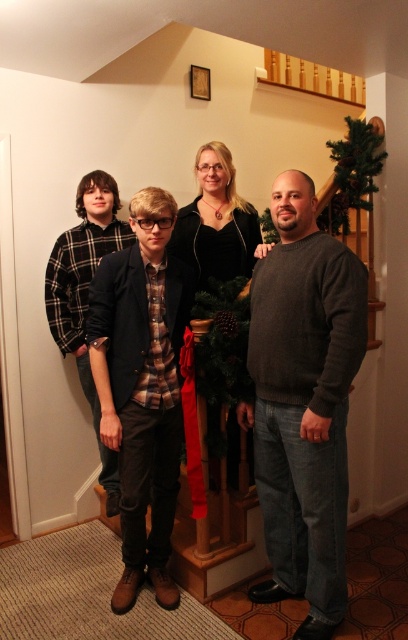
Question: From the image, what is the correct spatial relationship of dark gray sweater at right in relation to flannel shirt at left?

Choices:
 (A) left
 (B) right

Answer: (B)

Question: Does dark gray sweater at right appear on the left side of dark gray sweater at center?

Choices:
 (A) no
 (B) yes

Answer: (A)

Question: Which object appears farthest from the camera in this image?

Choices:
 (A) dark gray sweater at right
 (B) dark gray sweater at center
 (C) flannel shirt at left
 (D) dark brown leather jacket at center

Answer: (C)

Question: Which object appears closest to the camera in this image?

Choices:
 (A) dark brown leather jacket at center
 (B) flannel shirt at left
 (C) dark gray sweater at center
 (D) dark gray sweater at right

Answer: (C)

Question: Is dark brown leather jacket at center further to the viewer compared to flannel shirt at left?

Choices:
 (A) no
 (B) yes

Answer: (A)

Question: Which point is closer to the camera?

Choices:
 (A) (101, 392)
 (B) (308, 298)
 (C) (86, 241)
 (D) (312, 390)

Answer: (B)